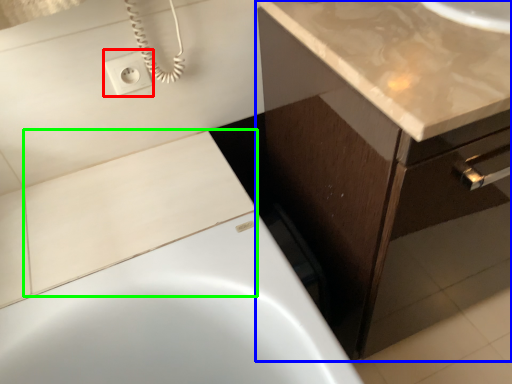
Question: Estimate the real-world distances between objects in this image. Which object is closer to electric outlet (highlighted by a red box), bathroom cabinet (highlighted by a blue box) or tile (highlighted by a green box)?

Choices:
 (A) bathroom cabinet
 (B) tile

Answer: (B)